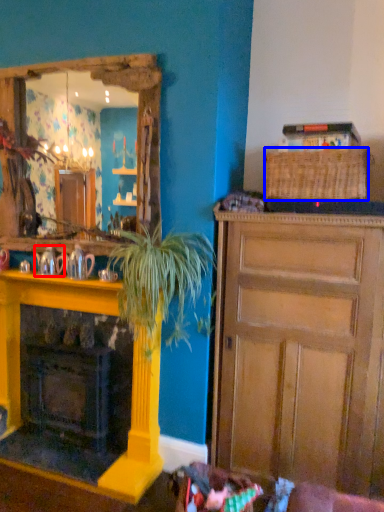
Question: Which object is further to the camera taking this photo, teapot (highlighted by a red box) or picnic basket (highlighted by a blue box)?

Choices:
 (A) teapot
 (B) picnic basket

Answer: (A)